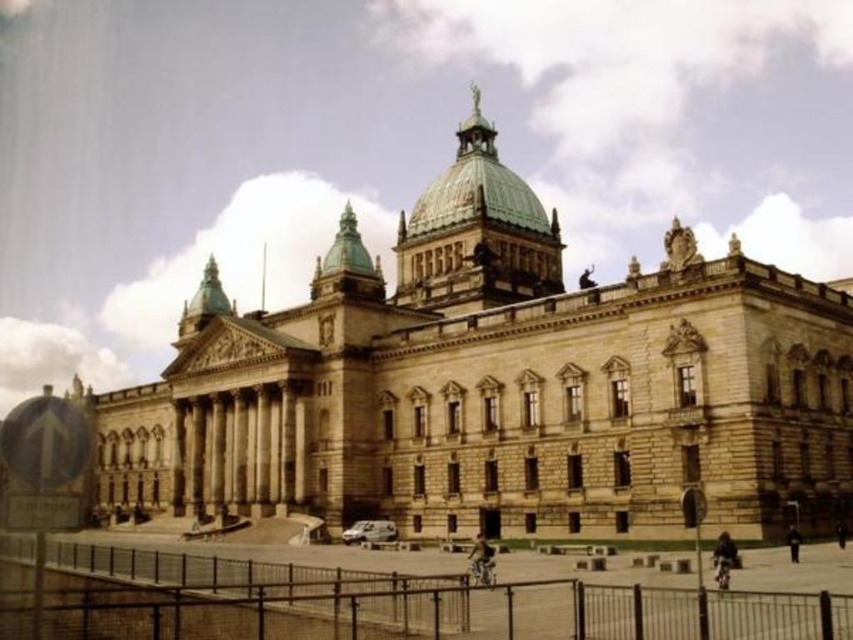
You are standing in front of the historic building and want to take a photo that includes both the central dome and the cyclist. You notice two points marked on your map as point 1 at coordinates point (x=596, y=337) and point 2 at coordinates point (x=711, y=618). Which point is closer to you, point 1 or point 2?

Point 1 at coordinates point (x=596, y=337) is closer to you because it is further to the viewer than point 2 at coordinates point (x=711, y=618).